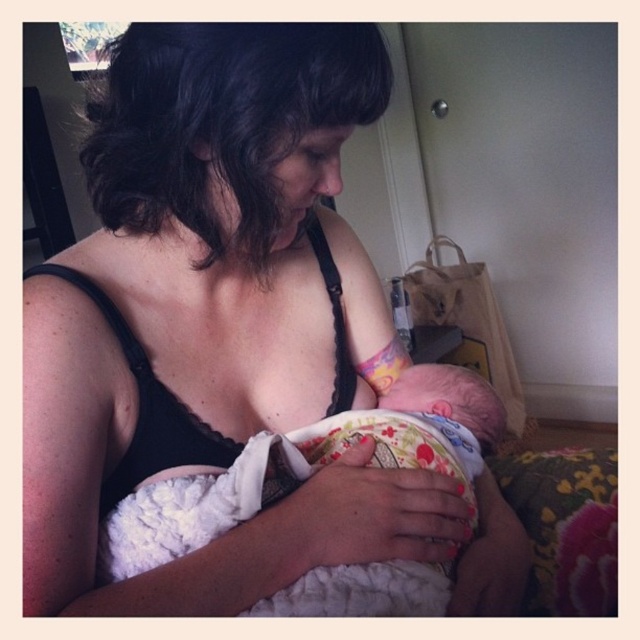
Which of these two, black lace tank top at center or fluffy white blanket at center, stands shorter?

Standing shorter between the two is fluffy white blanket at center.

Is black lace tank top at center further to the viewer compared to fluffy white blanket at center?

No, black lace tank top at center is in front of fluffy white blanket at center.

Image resolution: width=640 pixels, height=640 pixels. In order to click on black lace tank top at center in this screenshot , I will do (212, 317).